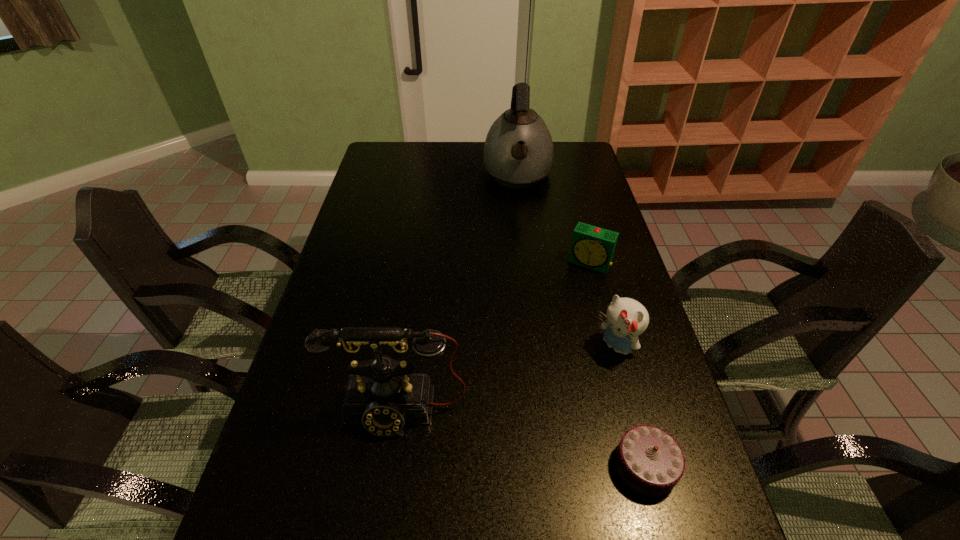
Image resolution: width=960 pixels, height=540 pixels. What are the coordinates of `object that is at the far edge` in the screenshot? It's located at (518, 151).

You are a GUI agent. You are given a task and a screenshot of the screen. Output one action in this format:
    pyautogui.click(x=<x>, y=<y>)
    Task: Click on the object situated at the near edge
    The height and width of the screenshot is (540, 960).
    Given the screenshot: What is the action you would take?
    pyautogui.click(x=649, y=460)

Image resolution: width=960 pixels, height=540 pixels. I want to click on object located in the left edge section of the desktop, so click(x=382, y=394).

Find the location of a particular element. chocolate cake at the right edge is located at coordinates (649, 460).

In order to click on kitten located in the right edge section of the desktop in this screenshot , I will do `click(626, 319)`.

The height and width of the screenshot is (540, 960). I want to click on alarm clock that is at the right edge, so click(x=592, y=247).

Identify the location of object that is at the near right corner. The image size is (960, 540). (649, 460).

Locate an element on the screen. vacant space at the far edge of the desktop is located at coordinates (416, 170).

Image resolution: width=960 pixels, height=540 pixels. I want to click on vacant point at the near edge, so click(408, 494).

In the image, there is a desktop. Where is `vacant space at the left edge`? vacant space at the left edge is located at coordinates (392, 181).